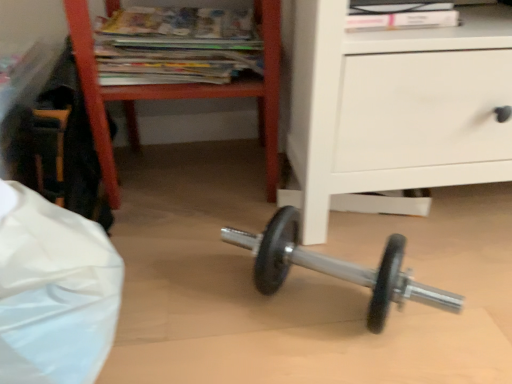
Where is `free space in front of wooden magazine rack at upper left`? This screenshot has width=512, height=384. free space in front of wooden magazine rack at upper left is located at coordinates (200, 259).